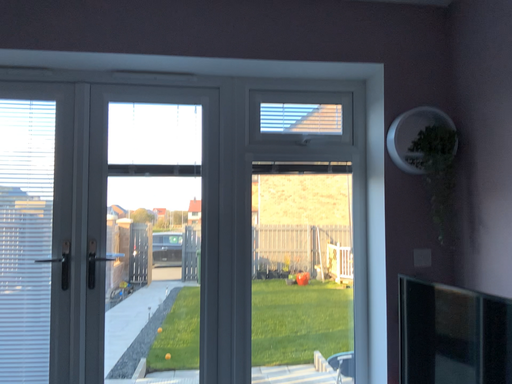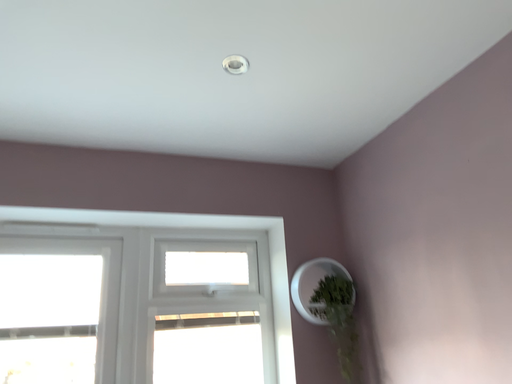
Question: How did the camera likely rotate when shooting the video?

Choices:
 (A) rotated right
 (B) rotated left

Answer: (A)